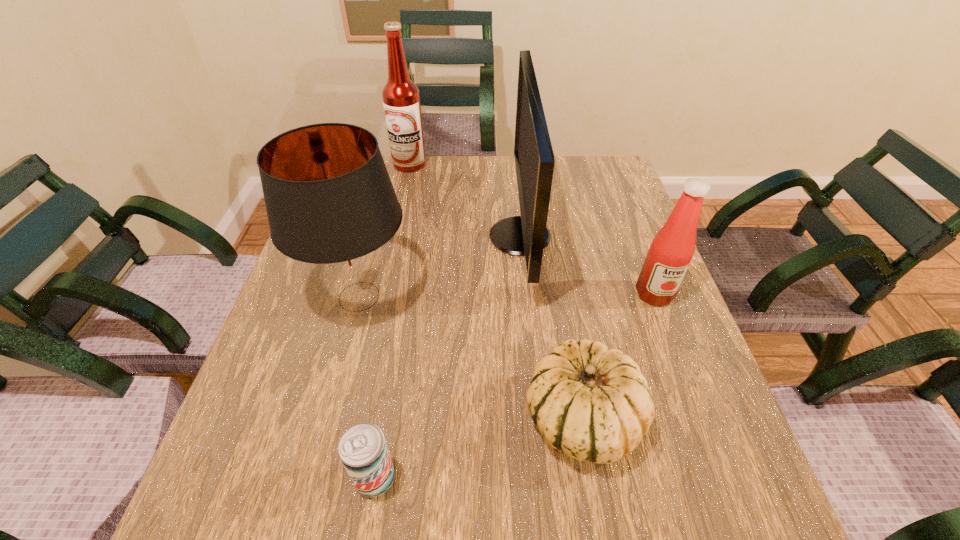
Locate an element on the screen. The width and height of the screenshot is (960, 540). free spot between the lampshade and the computer monitor is located at coordinates (440, 267).

Identify the location of free space that is in between the alcohol and the gourd. This screenshot has height=540, width=960. (496, 292).

Image resolution: width=960 pixels, height=540 pixels. I want to click on free area in between the computer monitor and the alcohol, so pos(465,200).

The width and height of the screenshot is (960, 540). Find the location of `free spot between the shortest object and the computer monitor`. free spot between the shortest object and the computer monitor is located at coordinates (447, 357).

Locate an element on the screen. Image resolution: width=960 pixels, height=540 pixels. free point between the condiment and the computer monitor is located at coordinates (588, 265).

Where is `the fifth closest object relative to the farthest object`? This screenshot has height=540, width=960. the fifth closest object relative to the farthest object is located at coordinates (363, 450).

The image size is (960, 540). What are the coordinates of `the closest object to the rightmost object` in the screenshot? It's located at (527, 234).

Identify the location of free space in the image that satisfies the following two spatial constraints: 1. on the front-facing side of the computer monitor; 2. on the left side of the second shortest object. (539, 420).

Locate an element on the screen. vacant space that satisfies the following two spatial constraints: 1. on the front-facing side of the computer monitor; 2. on the left side of the fifth tallest object is located at coordinates (x=539, y=420).

At what (x,y) coordinates should I click in order to perform the action: click on free location that satisfies the following two spatial constraints: 1. on the front-facing side of the computer monitor; 2. on the back side of the gourd. Please return your answer as a coordinate pair (x, y). Looking at the image, I should click on (539, 420).